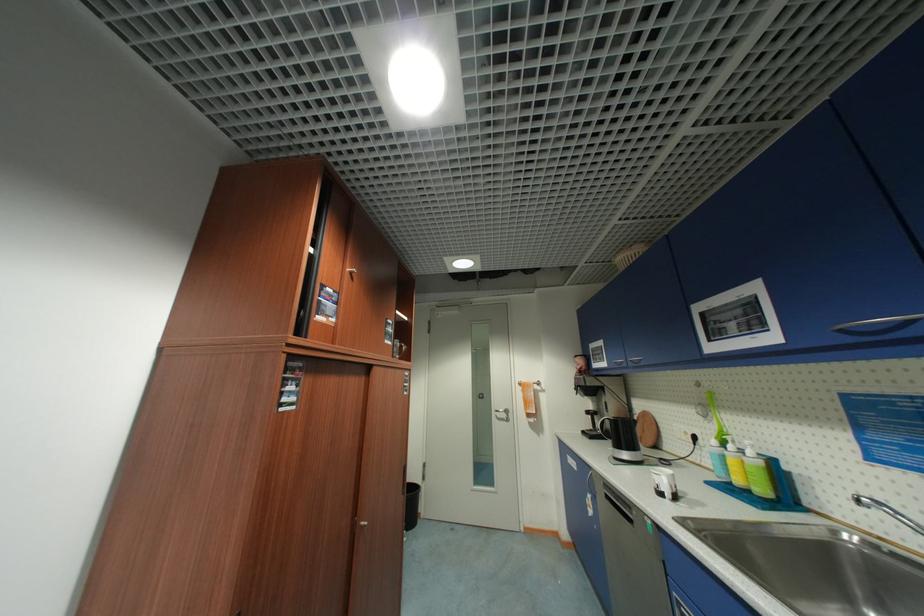
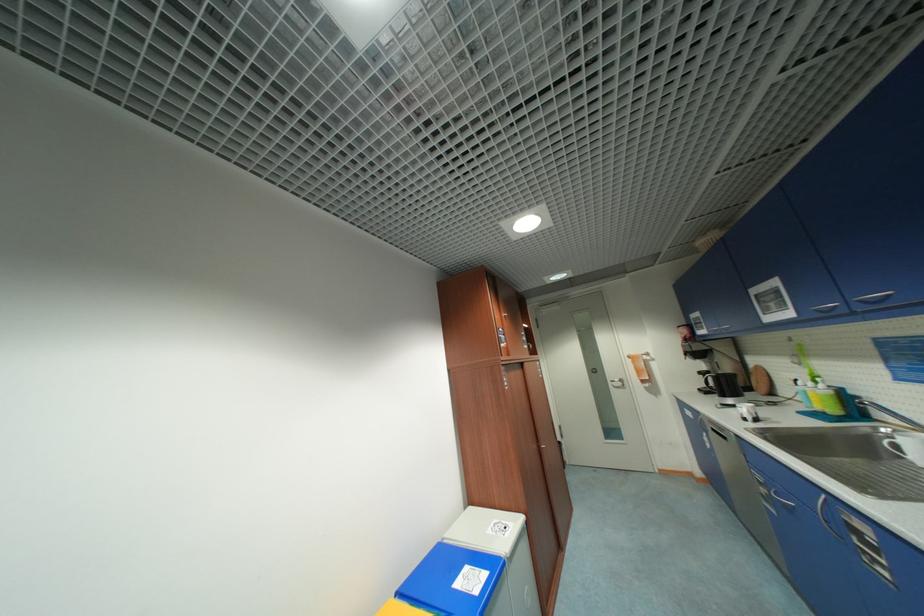
The point at (500,415) is marked in the first image. Where is the corresponding point in the second image?

(615, 384)